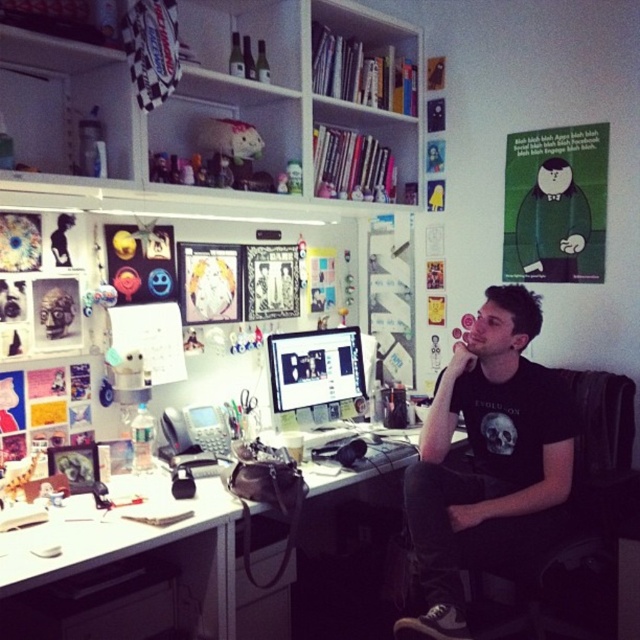
Who is higher up, black matte t-shirt at center or white glossy desk at lower left?

black matte t-shirt at center is higher up.

Between point (433, 470) and point (140, 541), which one is positioned behind?

The point (433, 470) is behind.

This screenshot has height=640, width=640. I want to click on black matte t-shirt at center, so 488,461.

You are a GUI agent. You are given a task and a screenshot of the screen. Output one action in this format:
    pyautogui.click(x=<x>, y=<y>)
    Task: Click on the black matte t-shirt at center
    
    Given the screenshot: What is the action you would take?
    pyautogui.click(x=488, y=461)

Is point (184, 76) in front of point (209, 564)?

No, it is behind (209, 564).

In the scene shown: Can you confirm if white wooden bookshelf at upper center is smaller than white glossy computer desk at center?

No.

This screenshot has width=640, height=640. Describe the element at coordinates (232, 102) in the screenshot. I see `white wooden bookshelf at upper center` at that location.

I want to click on white wooden bookshelf at upper center, so click(x=232, y=102).

Between white wooden bookshelf at upper center and black matte t-shirt at center, which one has less height?

white wooden bookshelf at upper center

Which is behind, point (214, 35) or point (452, 422)?

The point (214, 35) is behind.

Is point (401, 72) closer to viewer compared to point (493, 509)?

No.

Find the location of `white wooden bookshelf at upper center`. white wooden bookshelf at upper center is located at coordinates (232, 102).